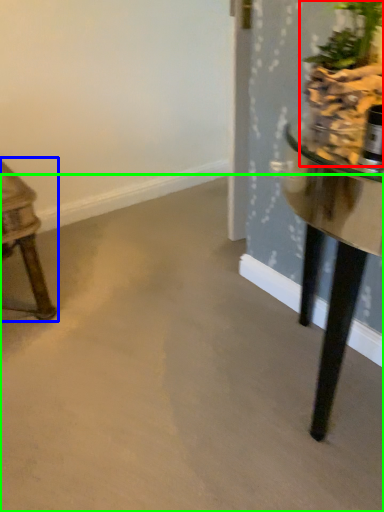
Question: Considering the real-world distances, which object is farthest from houseplant (highlighted by a red box)? table (highlighted by a blue box) or concrete (highlighted by a green box)?

Choices:
 (A) table
 (B) concrete

Answer: (A)